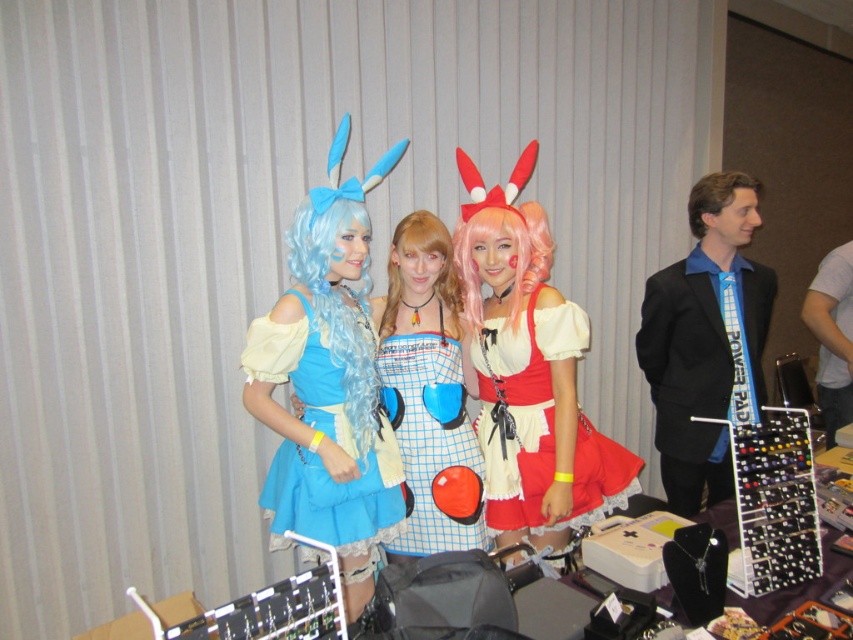
Question: Does checkered fabric dress at center have a smaller size compared to brown synthetic wig at right?

Choices:
 (A) yes
 (B) no

Answer: (B)

Question: Is checkered fabric dress at center bigger than red satin dress at center?

Choices:
 (A) yes
 (B) no

Answer: (B)

Question: Is matte blue fabric dress at center to the right of red satin dress at center from the viewer's perspective?

Choices:
 (A) no
 (B) yes

Answer: (A)

Question: Which object appears closest to the camera in this image?

Choices:
 (A) pink silky wig at center
 (B) brown synthetic wig at right

Answer: (A)

Question: Which object is farther from the camera taking this photo?

Choices:
 (A) checkered fabric dress at center
 (B) pink silky wig at center
 (C) black suit at right

Answer: (C)

Question: Among these objects, which one is nearest to the camera?

Choices:
 (A) checkered fabric dress at center
 (B) black suit at right
 (C) white fabric shirt at right
 (D) light brown silky wig at center

Answer: (D)